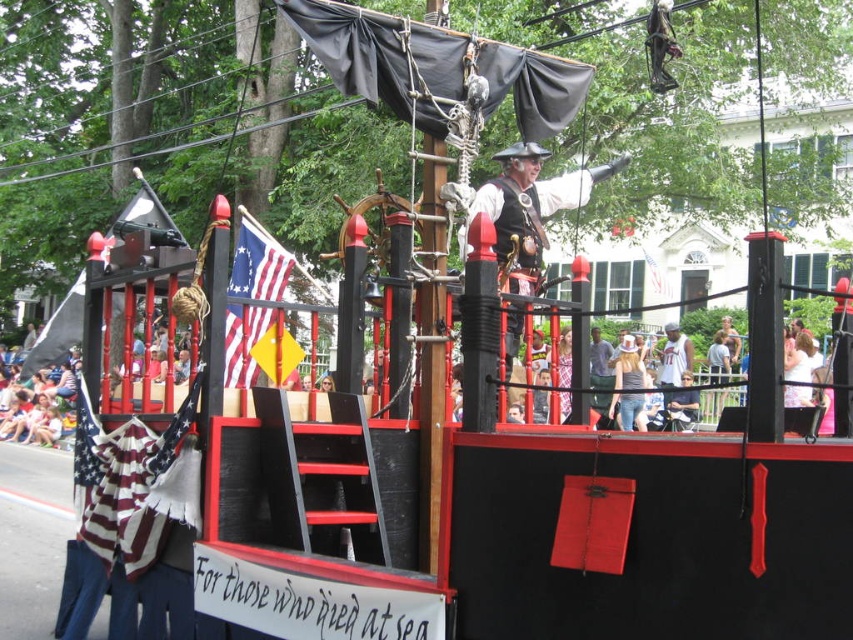
You are a parade attendee standing in front of the pirate ship float. You notice the matte black pirate at center and the american flag at center. Which object is wider?

The matte black pirate at center is wider than the american flag at center according to the description.

You are a spectator at the parade and want to take a photo of both the matte black pirate at center and the american flag at center. Which object should you focus on first to ensure both are in the frame?

You should focus on the american flag at center first because the matte black pirate at center is positioned to its right, so by centering the flag, you can adjust the camera to include both objects in the frame.